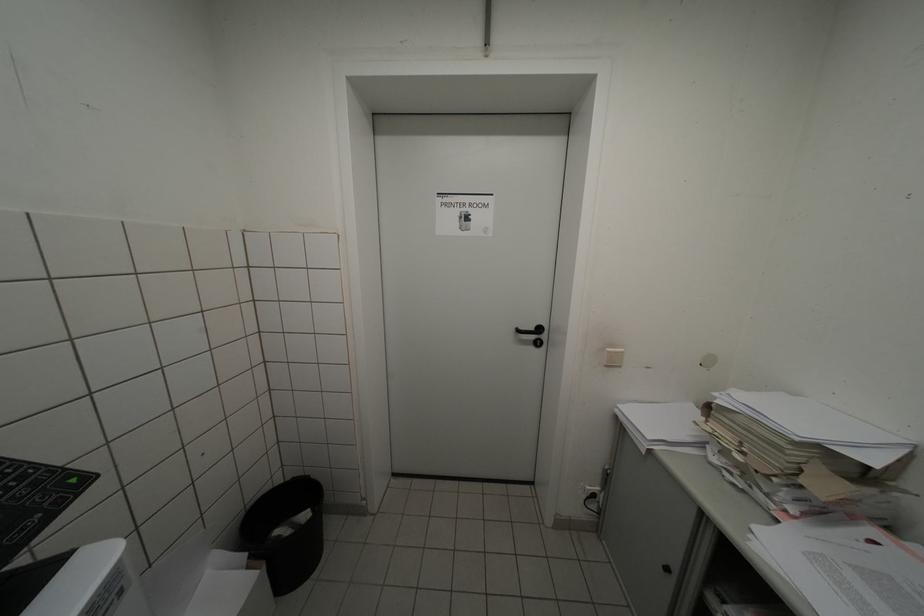
What do you see at coordinates (532, 334) in the screenshot? This screenshot has height=616, width=924. I see `a black door handle` at bounding box center [532, 334].